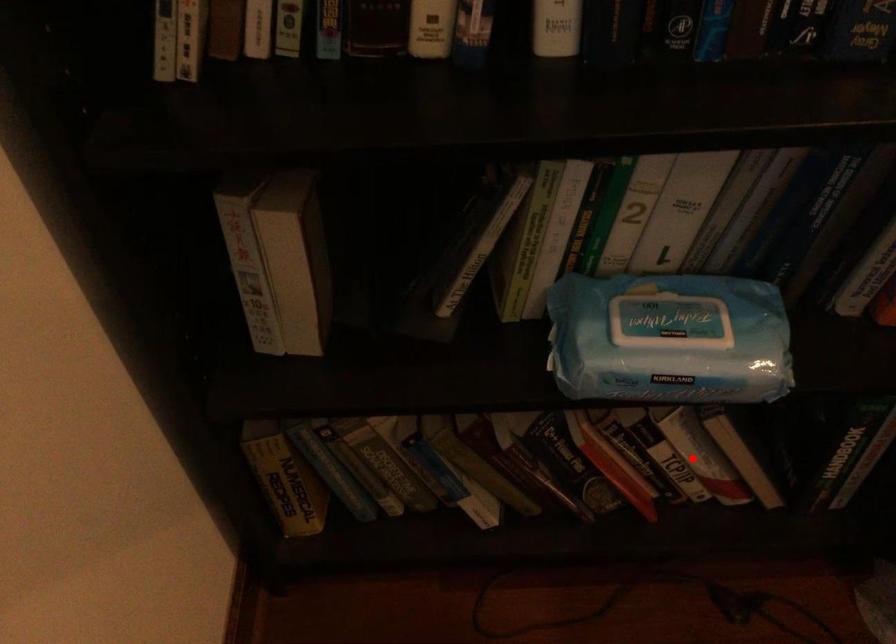
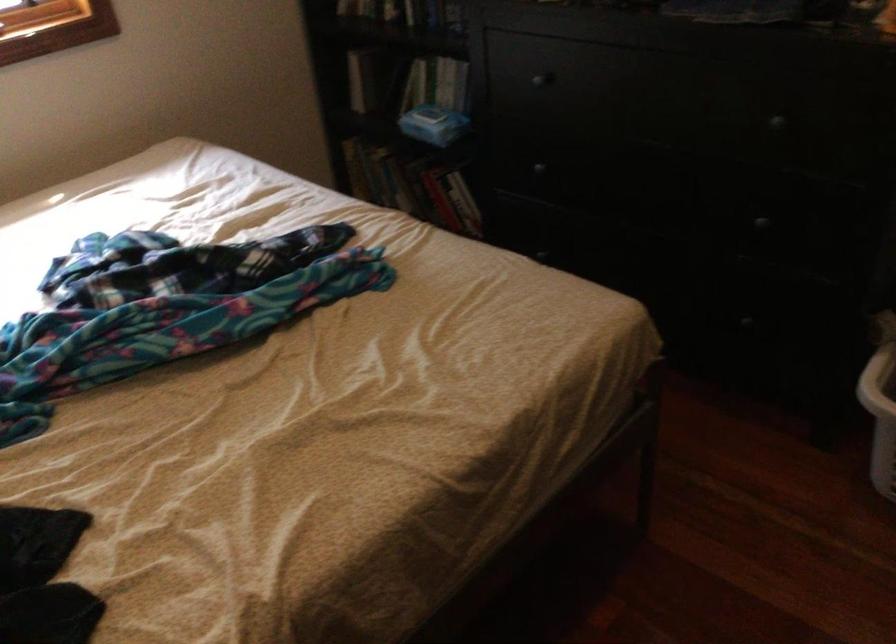
Question: I am providing you with two images of the same scene from different viewpoints. Given a red point in image1, look at the same physical point in image2. Is it:

Choices:
 (A) Closer to the viewpoint
 (B) Farther from the viewpoint

Answer: (B)